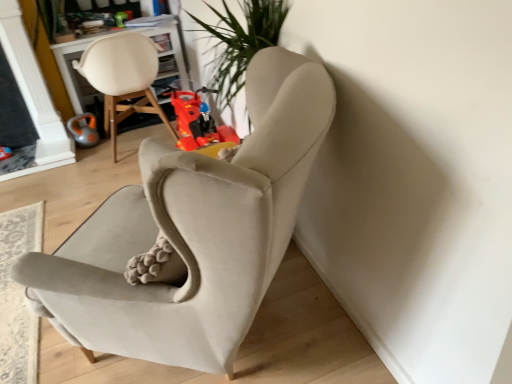
Question: From a real-world perspective, is matte white chair at upper left, which appears as the second chair when viewed from the right, positioned above or below orange rubber toy at left, marked as the first toy in a left-to-right arrangement?

Choices:
 (A) above
 (B) below

Answer: (A)

Question: In terms of width, does matte white chair at upper left, marked as the 1th chair in a left-to-right arrangement, look wider or thinner when compared to orange rubber toy at left, marked as the first toy in a left-to-right arrangement?

Choices:
 (A) wide
 (B) thin

Answer: (A)

Question: Estimate the real-world distances between objects in this image. Which object is farther from the suede beige armchair at center, the first chair viewed from the right?

Choices:
 (A) rubberized plastic toy motorcycle at center, which is the first toy in right-to-left order
 (B) orange rubber toy at left, which is the second toy from right to left
 (C) matte white chair at upper left, marked as the 1th chair in a left-to-right arrangement

Answer: (B)

Question: Estimate the real-world distances between objects in this image. Which object is closer to the matte white chair at upper left, which appears as the second chair when viewed from the right?

Choices:
 (A) orange rubber toy at left, which is the second toy from right to left
 (B) rubberized plastic toy motorcycle at center, which is the first toy in right-to-left order
 (C) suede beige armchair at center, positioned as the second chair in left-to-right order

Answer: (A)